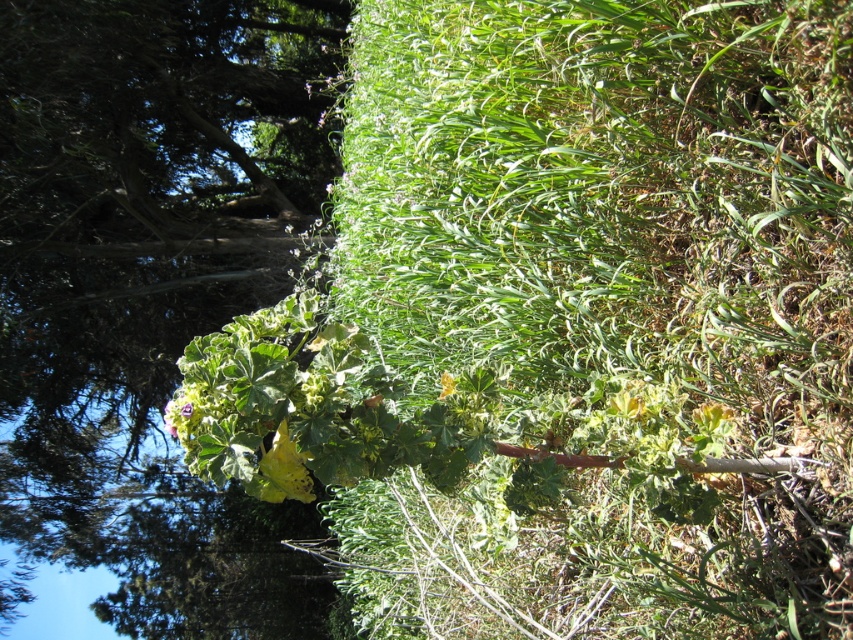
You are a botanist examining the plant in the image. You notice a yellow matte leaf at center. Can you provide the exact coordinates of this leaf?

The yellow matte leaf at center is located at coordinates point (287, 467).